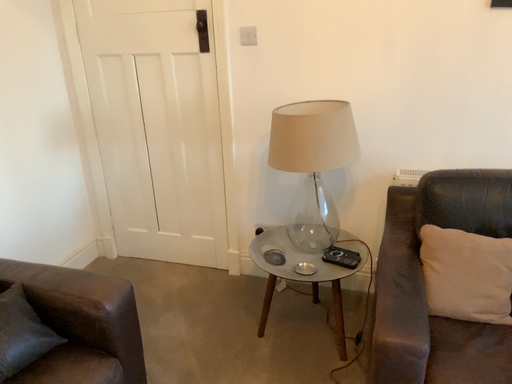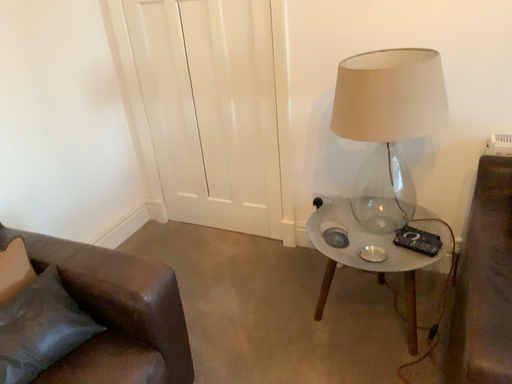
Question: Which way did the camera rotate in the video?

Choices:
 (A) rotated right
 (B) rotated left

Answer: (B)